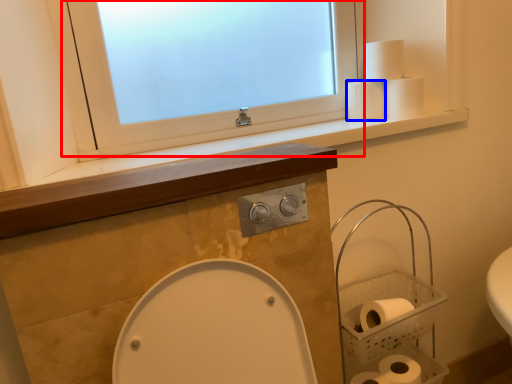
Question: Which object appears closest to the camera in this image, window (highlighted by a red box) or toilet paper (highlighted by a blue box)?

Choices:
 (A) window
 (B) toilet paper

Answer: (A)